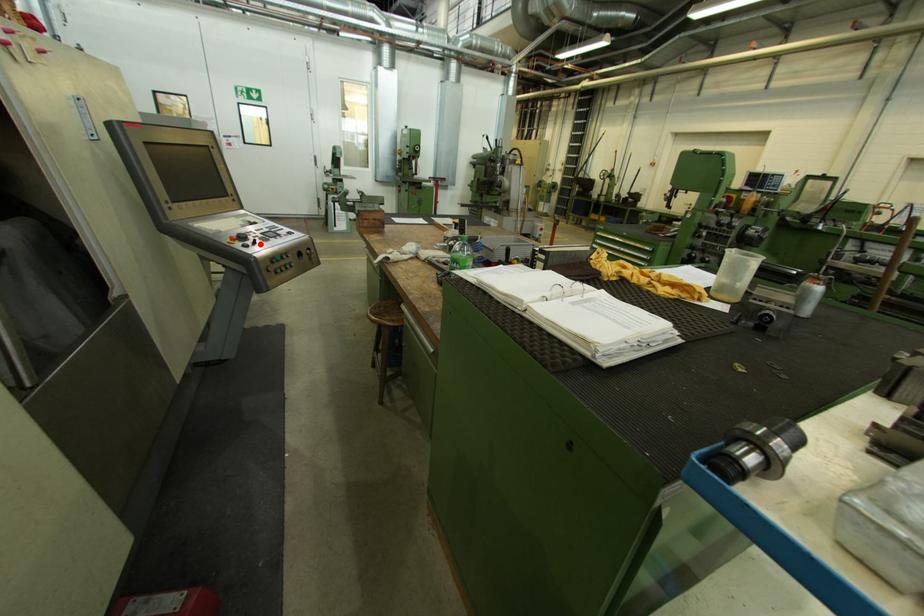
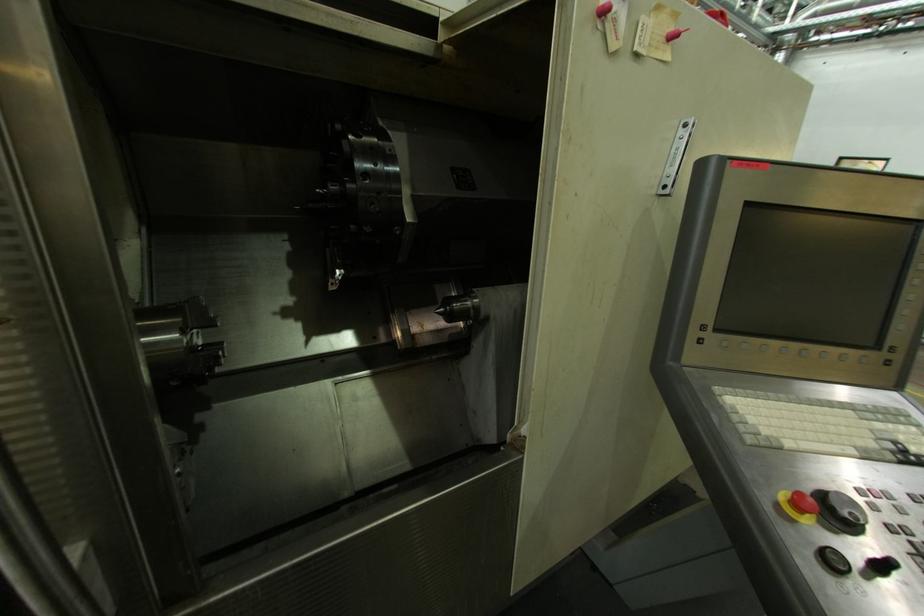
Question: A red point is marked in image1. In image2, is the corresponding 3D point closer to the camera or farther? Reply with the corresponding letter.

Choices:
 (A) The corresponding 3D point is closer.
 (B) The corresponding 3D point is farther.

Answer: (A)